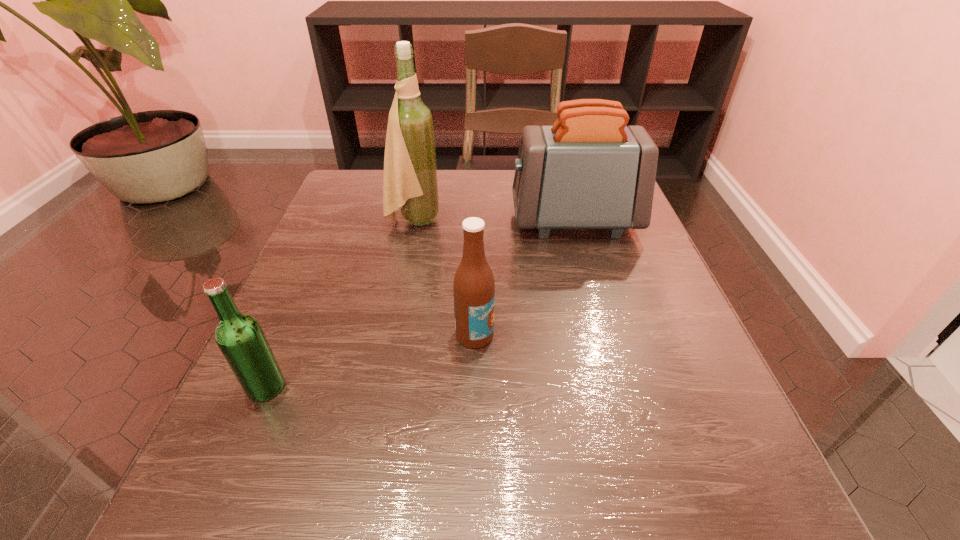
Image resolution: width=960 pixels, height=540 pixels. Find the location of `vacant position in the image that satisfies the following two spatial constraints: 1. on the front-facing side of the third object from right to left; 2. on the right side of the farther beer bottle`. vacant position in the image that satisfies the following two spatial constraints: 1. on the front-facing side of the third object from right to left; 2. on the right side of the farther beer bottle is located at coordinates (391, 334).